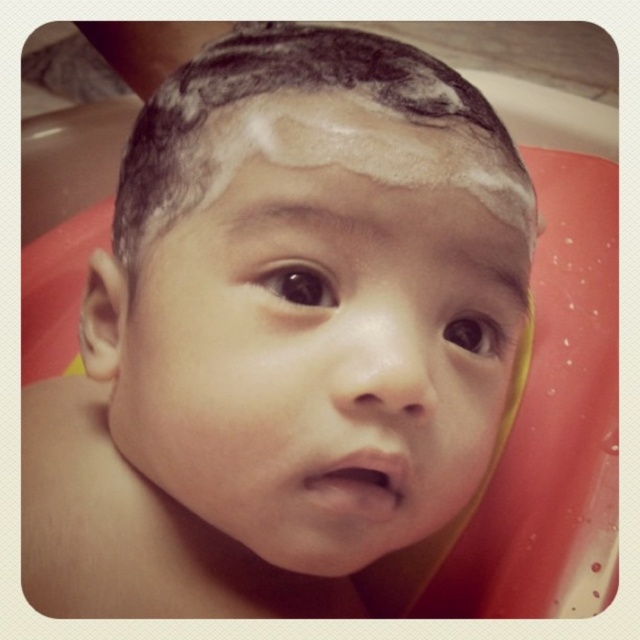
Which is more to the right, smooth skin baby at center or wet dark brown hair at center?

Positioned to the right is wet dark brown hair at center.

Is smooth skin baby at center shorter than wet dark brown hair at center?

Incorrect, smooth skin baby at center's height does not fall short of wet dark brown hair at center's.

The image size is (640, 640). Identify the location of smooth skin baby at center. (320, 358).